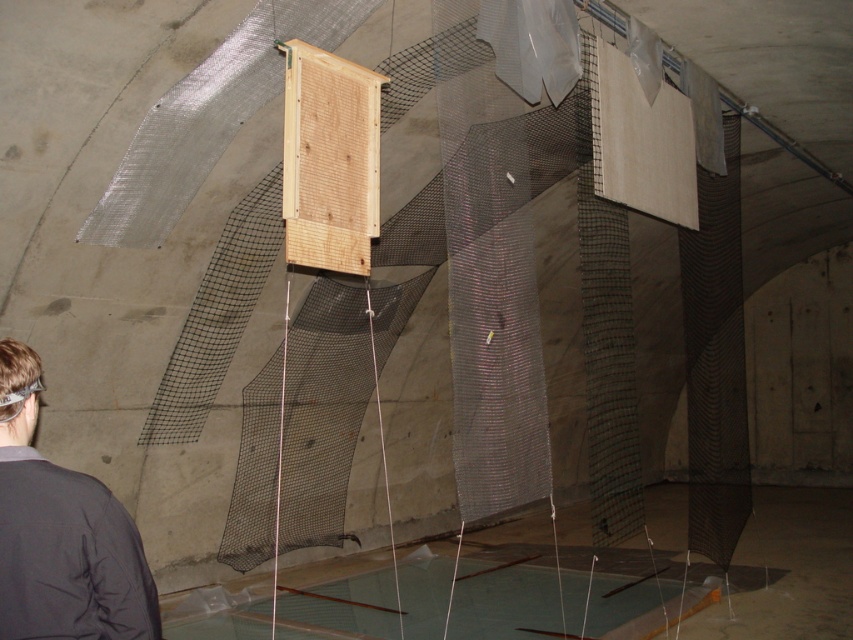
You are a worker in this tunnel and need to place both the dark gray jacket at lower left and the clear plastic goggles at lower left on a shelf that can only hold items up to 1 meter in width. Can you fit both items on the shelf together?

The dark gray jacket at lower left might be wider than clear plastic goggles at lower left, so the total width of both items could exceed the 1 meter limit. It is uncertain if they will fit together on the shelf.

You are navigating through the maze of netting in the image and notice two items at the lower left corner. Which item is closer to you, the dark gray jacket at lower left or the clear plastic goggles at lower left?

The dark gray jacket at lower left is closer to you because it is in front of the clear plastic goggles at lower left.

You are a delivery person who needs to place a package that is 2 meters long in the tunnel. You see the dark gray jacket at lower left. Can you fit the package horizontally next to it without moving the jacket?

The dark gray jacket at lower left is 1.97 meters from the camera. Since the package is 2 meters long, it is slightly longer than the available space next to the jacket. Therefore, the package cannot be placed horizontally next to the dark gray jacket at lower left without moving it.